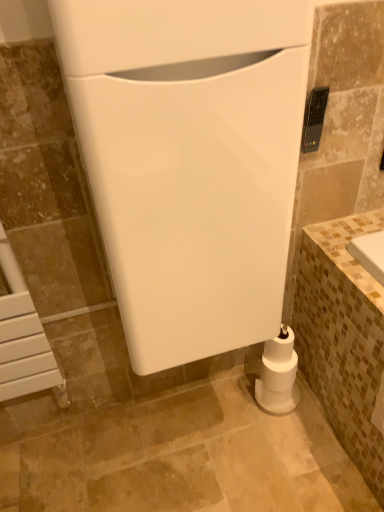
Question: From a real-world perspective, is white matte toilet paper at lower right positioned over black plastic remote control at upper right, the second appliance positioned from the left, based on gravity?

Choices:
 (A) yes
 (B) no

Answer: (B)

Question: Is white matte toilet paper at lower right far from black plastic remote control at upper right, arranged as the second appliance when viewed from the front?

Choices:
 (A) yes
 (B) no

Answer: (B)

Question: Does white matte toilet paper at lower right lie in front of black plastic remote control at upper right, the second appliance positioned from the left?

Choices:
 (A) no
 (B) yes

Answer: (A)

Question: Is white matte toilet paper at lower right taller than black plastic remote control at upper right, arranged as the first appliance when viewed from the right?

Choices:
 (A) yes
 (B) no

Answer: (A)

Question: Considering the relative sizes of white matte toilet paper at lower right and black plastic remote control at upper right, the second appliance positioned from the left, in the image provided, is white matte toilet paper at lower right shorter than black plastic remote control at upper right, the second appliance positioned from the left,?

Choices:
 (A) no
 (B) yes

Answer: (A)

Question: Is black plastic remote control at upper right, the first appliance when ordered from back to front, to the left or to the right of white glossy toilet at center, which is the first appliance in left-to-right order, in the image?

Choices:
 (A) left
 (B) right

Answer: (B)

Question: In terms of width, does black plastic remote control at upper right, the first appliance when ordered from back to front, look wider or thinner when compared to white glossy toilet at center, the 2th appliance in the right-to-left sequence?

Choices:
 (A) wide
 (B) thin

Answer: (B)

Question: From the image's perspective, is black plastic remote control at upper right, arranged as the first appliance when viewed from the right, located above or below white glossy toilet at center, which is the second appliance in back-to-front order?

Choices:
 (A) above
 (B) below

Answer: (A)

Question: From a real-world perspective, relative to white glossy toilet at center, which is the first appliance in left-to-right order, is black plastic remote control at upper right, the second appliance positioned from the left, vertically above or below?

Choices:
 (A) below
 (B) above

Answer: (B)

Question: From a real-world perspective, is white glossy toilet at center, marked as the first appliance in a front-to-back arrangement, physically located above or below black plastic remote control at upper right, arranged as the first appliance when viewed from the right?

Choices:
 (A) above
 (B) below

Answer: (B)

Question: Relative to black plastic remote control at upper right, the first appliance when ordered from back to front, is white glossy toilet at center, which is the first appliance in left-to-right order, in front or behind?

Choices:
 (A) front
 (B) behind

Answer: (A)

Question: Looking at their shapes, would you say white glossy toilet at center, marked as the first appliance in a front-to-back arrangement, is wider or thinner than black plastic remote control at upper right, the first appliance when ordered from back to front?

Choices:
 (A) thin
 (B) wide

Answer: (B)

Question: From the image's perspective, is white glossy toilet at center, which is the second appliance in back-to-front order, above or below black plastic remote control at upper right, the first appliance when ordered from back to front?

Choices:
 (A) above
 (B) below

Answer: (B)

Question: From the image's perspective, is white matte toilet paper at lower right above or below white glossy toilet at center, marked as the first appliance in a front-to-back arrangement?

Choices:
 (A) below
 (B) above

Answer: (A)

Question: Is point (276, 411) positioned closer to the camera than point (130, 24)?

Choices:
 (A) closer
 (B) farther

Answer: (B)